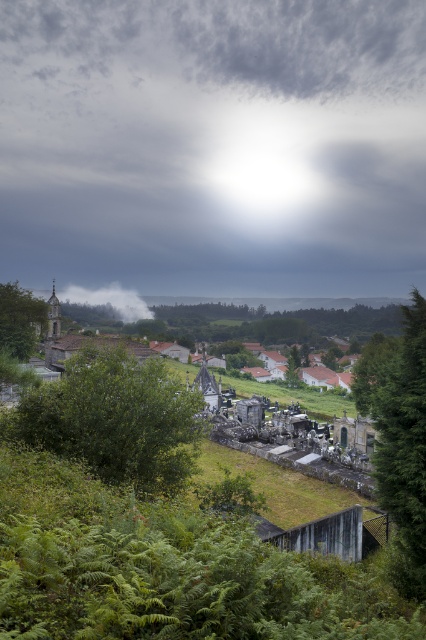
Between green leafy tree at right and green matte tree at lower left, which one is positioned higher?

green matte tree at lower left is above.

Is point (383, 349) positioned in front of point (9, 314)?

No.

The height and width of the screenshot is (640, 426). What do you see at coordinates (400, 436) in the screenshot? I see `green leafy tree at right` at bounding box center [400, 436].

Where is `green leafy tree at right`? green leafy tree at right is located at coordinates (400, 436).

Is green leafy bush at center thinner than green leafy tree at right?

Yes.

Can you confirm if green leafy bush at center is positioned below green leafy tree at right?

Correct, green leafy bush at center is located below green leafy tree at right.

Is point (71, 433) more distant than point (420, 438)?

Yes, point (71, 433) is behind point (420, 438).

In order to click on green leafy bush at center in this screenshot , I will do `click(115, 419)`.

Is point (111, 417) positioned behind point (118, 296)?

No.

Which is in front, point (161, 470) or point (118, 300)?

Point (161, 470) is more forward.

The image size is (426, 640). I want to click on green leafy bush at center, so click(115, 419).